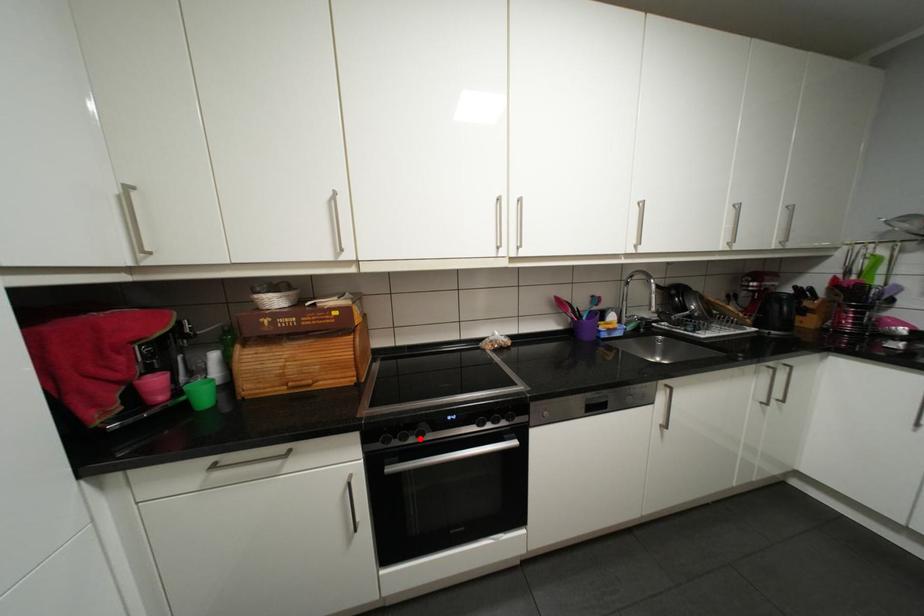
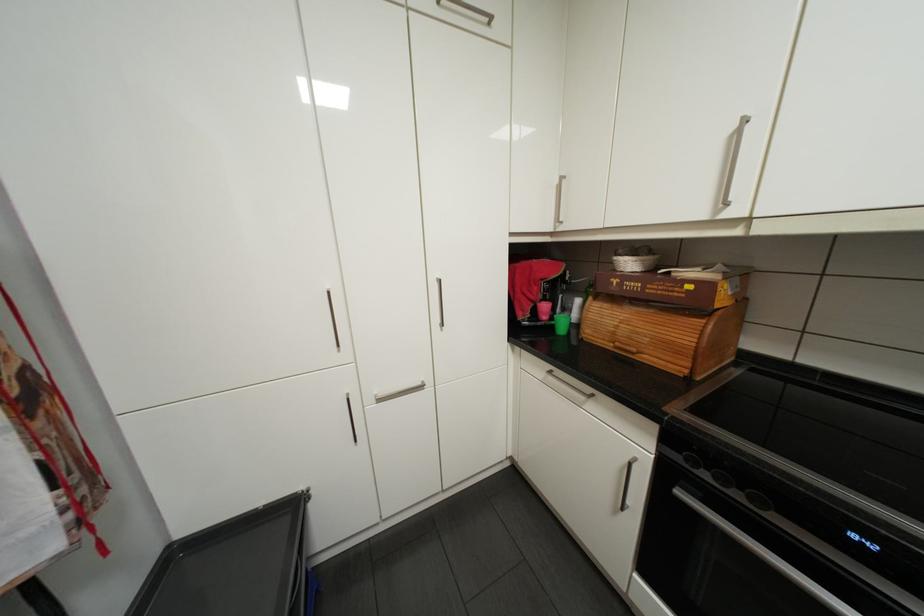
Question: I am providing you with two images of the same scene from different viewpoints. A red point is shown in image1. For the corresponding object point in image2, is it positioned nearer or farther from the camera?

Choices:
 (A) Nearer
 (B) Farther

Answer: (A)